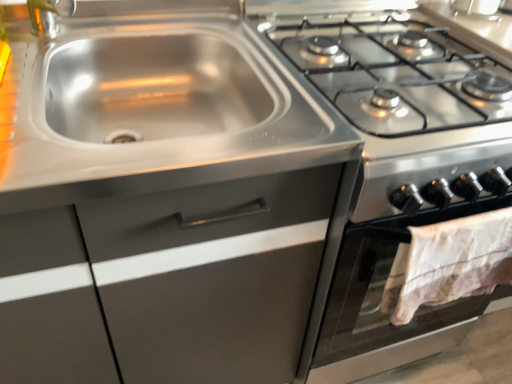
Question: From a real-world perspective, is white lace towel at lower right below stainless steel sink at upper left?

Choices:
 (A) yes
 (B) no

Answer: (A)

Question: Is there a large distance between white lace towel at lower right and stainless steel sink at upper left?

Choices:
 (A) yes
 (B) no

Answer: (B)

Question: From a real-world perspective, is white lace towel at lower right on stainless steel sink at upper left?

Choices:
 (A) yes
 (B) no

Answer: (B)

Question: Is the surface of white lace towel at lower right in direct contact with stainless steel sink at upper left?

Choices:
 (A) yes
 (B) no

Answer: (B)

Question: Considering the relative sizes of white lace towel at lower right and stainless steel sink at upper left in the image provided, is white lace towel at lower right wider than stainless steel sink at upper left?

Choices:
 (A) no
 (B) yes

Answer: (A)

Question: Is white lace towel at lower right to the left of stainless steel sink at upper left from the viewer's perspective?

Choices:
 (A) yes
 (B) no

Answer: (B)

Question: Is white lace towel at lower right taller than stainless steel stove at upper right?

Choices:
 (A) no
 (B) yes

Answer: (A)

Question: From a real-world perspective, is white lace towel at lower right physically below stainless steel stove at upper right?

Choices:
 (A) no
 (B) yes

Answer: (A)

Question: From a real-world perspective, is white lace towel at lower right positioned over stainless steel stove at upper right based on gravity?

Choices:
 (A) no
 (B) yes

Answer: (B)

Question: Considering the relative sizes of white lace towel at lower right and stainless steel stove at upper right in the image provided, is white lace towel at lower right thinner than stainless steel stove at upper right?

Choices:
 (A) no
 (B) yes

Answer: (B)

Question: Does white lace towel at lower right appear on the right side of stainless steel stove at upper right?

Choices:
 (A) no
 (B) yes

Answer: (B)

Question: Is white lace towel at lower right smaller than stainless steel stove at upper right?

Choices:
 (A) no
 (B) yes

Answer: (B)

Question: Would you consider stainless steel cabinet at upper left to be distant from stainless steel stove at upper right?

Choices:
 (A) yes
 (B) no

Answer: (B)